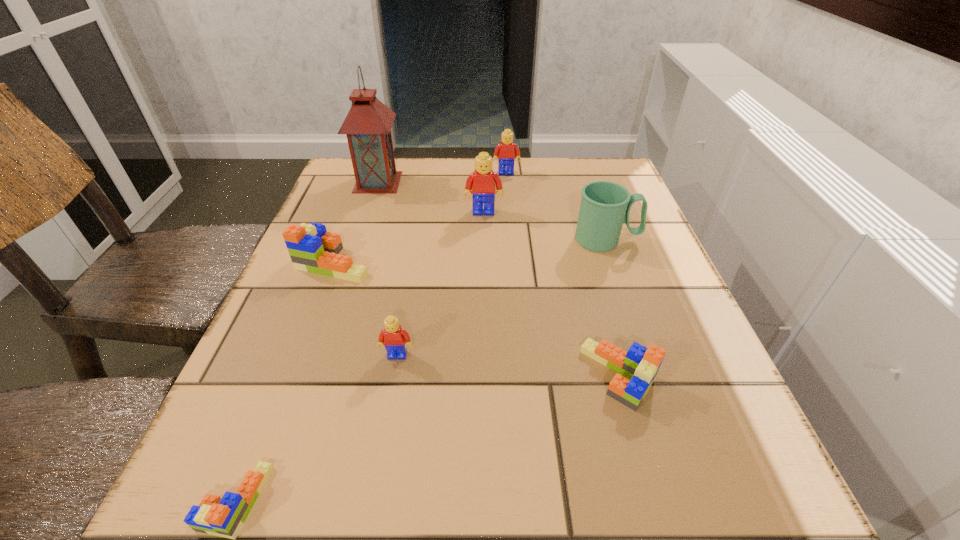
Locate an element on the screen. Image resolution: width=960 pixels, height=540 pixels. orange Lego that stands as the second closest to the tallest object is located at coordinates (640, 364).

Select which orange Lego is the second closest to the green mug. Please provide its 2D coordinates. Your answer should be formatted as a tuple, i.e. [(x, y)], where the tuple contains the x and y coordinates of a point satisfying the conditions above.

[(312, 249)]

This screenshot has width=960, height=540. What are the coordinates of `free space that satisfies the following two spatial constraints: 1. on the side of the green mug with the handle; 2. on the front-facing side of the third Lego from left to right` in the screenshot? It's located at (647, 355).

This screenshot has height=540, width=960. Find the location of `free space that satisfies the following two spatial constraints: 1. on the side of the green mug with the handle; 2. on the front side of the fourth nearest Lego`. free space that satisfies the following two spatial constraints: 1. on the side of the green mug with the handle; 2. on the front side of the fourth nearest Lego is located at coordinates (614, 262).

Find the location of a particular element. The height and width of the screenshot is (540, 960). free region that satisfies the following two spatial constraints: 1. on the front-facing side of the rightmost Lego; 2. on the left side of the second biggest yellow Lego is located at coordinates (524, 375).